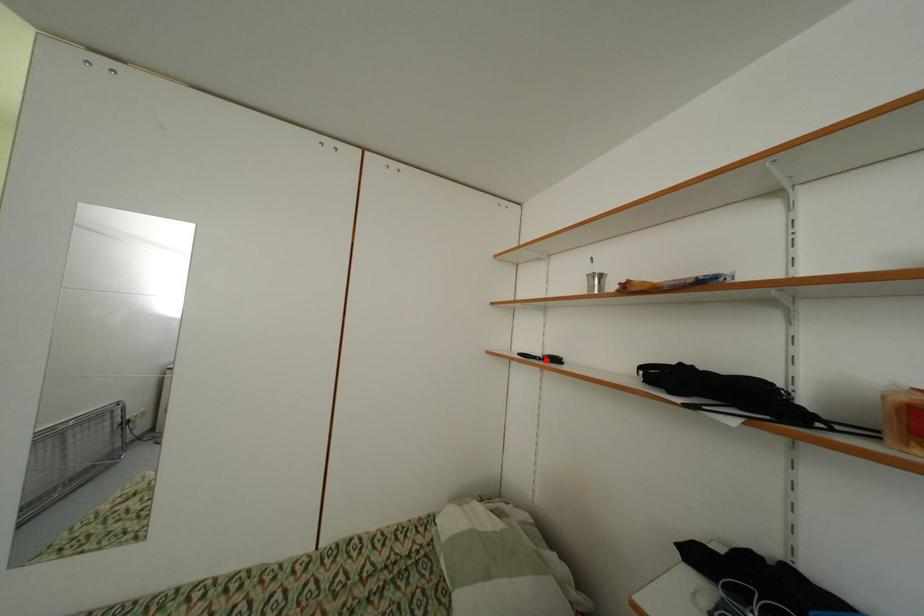
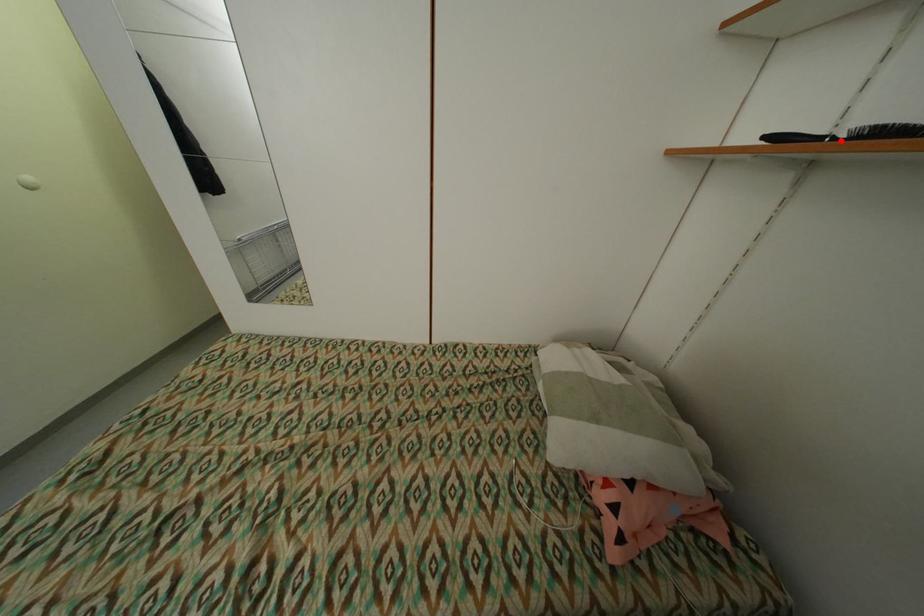
I am providing you with two images of the same scene from different viewpoints. A red point is marked on the first image and another point is marked on the second image. Does the point marked in image1 correspond to the same location as the one in image2?

Yes